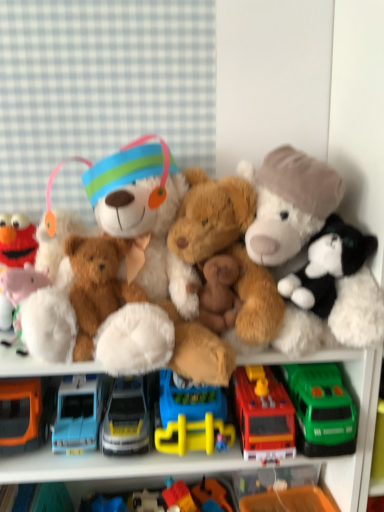
Question: From a real-world perspective, is blue plastic toy truck at center, placed as the 1th truck when sorted from left to right, physically located above or below fluffy brown teddy bear at center, marked as the 7th toy in a left-to-right arrangement?

Choices:
 (A) above
 (B) below

Answer: (B)

Question: Based on their sizes in the image, would you say blue plastic toy truck at center, placed as the 1th truck when sorted from left to right, is bigger or smaller than fluffy brown teddy bear at center, the 3th toy positioned from the right?

Choices:
 (A) big
 (B) small

Answer: (B)

Question: Which object is the closest to the brown plush bear at center, the second toy in the left-to-right sequence?

Choices:
 (A) black plush cat at right, acting as the ninth toy starting from the left
 (B) shiny red plastic truck at center, the second truck viewed from the right
 (C) plastic toy car at center, the 3th toy in the left-to-right sequence
 (D) shiny silver truck at center, marked as the 2th truck in a left-to-right arrangement
 (E) rubber duck at center, the fourth toy viewed from the right

Answer: (D)

Question: Considering the real-world distances, which object is closest to the green plastic truck at lower right, which is the first truck from right to left?

Choices:
 (A) fluffy white stuffed animal at right, the 2th toy in the right-to-left sequence
 (B) fluffy white teddy bear at center
 (C) brown plush bear at center, arranged as the fifth toy when viewed from the left
 (D) plastic toy car at center, which ranks as the 7th toy in right-to-left order
 (E) shiny silver truck at center, which appears as the 4th truck when viewed from the right

Answer: (A)